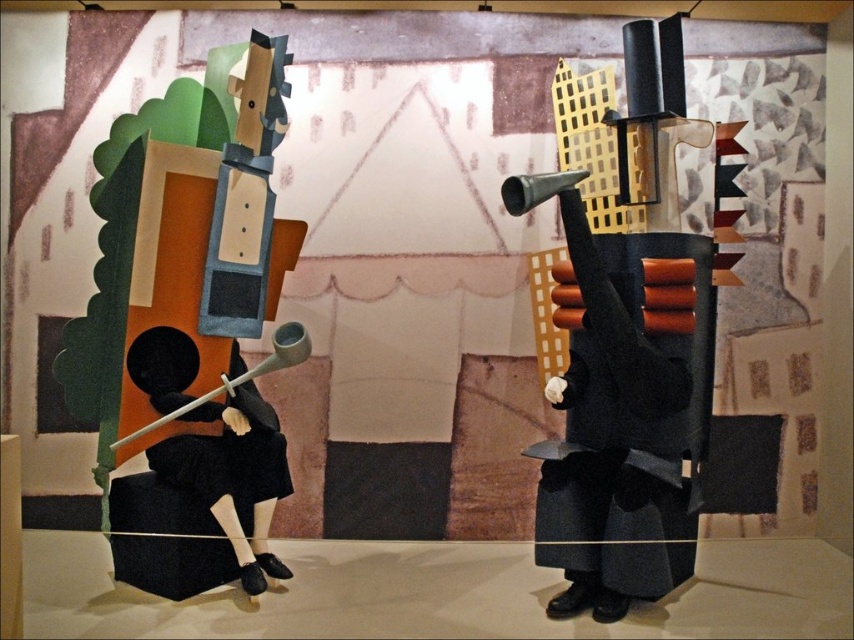
You are an art curator examining the surrealistic scene. You need to determine the spatial relationship between the matte black coat at right and the black matte figure at left. Based on the scene, which object is positioned higher?

The matte black coat at right is above the black matte figure at left, so the matte black coat at right is positioned higher.

You are standing in front of the surrealistic scene with two figures in dark costumes. You notice two points marked in the image. The first point is at coordinate (642, 570) and the second is at (156, 468). Which of these two points is nearer to you?

Point (642, 570) is closer to the viewer than point (156, 468).

You are an art curator planning to display the matte black violin at left and the black matte figure at left in a gallery. The minimum distance required between any two displayed items is 16 centimeters for safety. Based on the current spacing in the image, will the violin and the figure meet this requirement?

The matte black violin at left is only 15.24 centimeters away from the black matte figure at left, which is less than the required 16 centimeters. Therefore, they do not meet the safety distance requirement and need to be adjusted to ensure proper spacing.